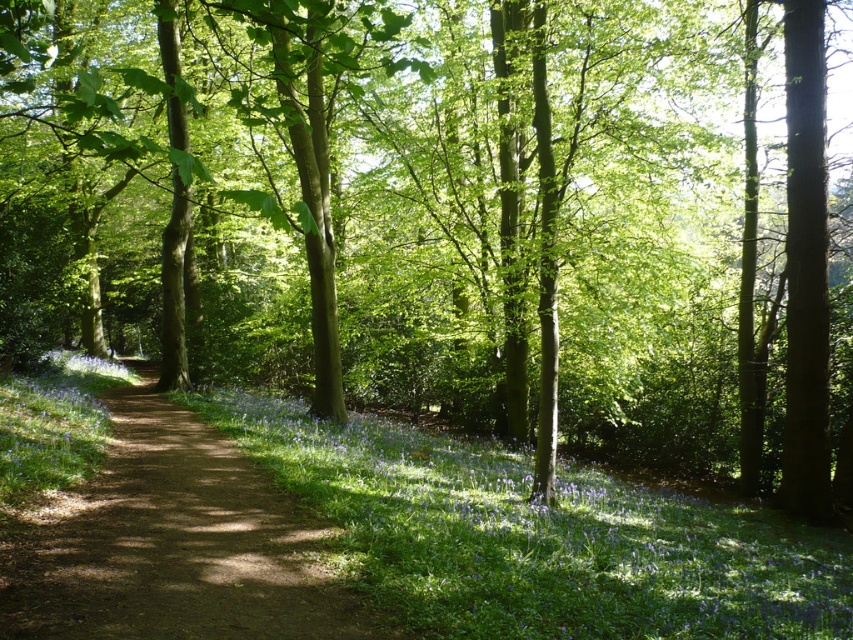
Is blue matte flowers at center above dirt path at center?

Actually, blue matte flowers at center is below dirt path at center.

Between point (402, 540) and point (173, 435), which one is positioned behind?

The point (173, 435) is behind.

This screenshot has height=640, width=853. Describe the element at coordinates (537, 538) in the screenshot. I see `blue matte flowers at center` at that location.

You are a GUI agent. You are given a task and a screenshot of the screen. Output one action in this format:
    pyautogui.click(x=<x>, y=<y>)
    Task: Click on the blue matte flowers at center
    
    Given the screenshot: What is the action you would take?
    pyautogui.click(x=537, y=538)